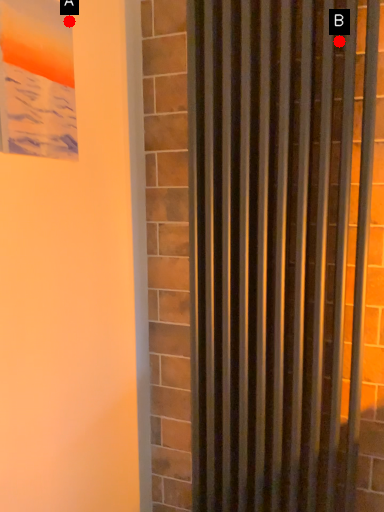
Question: Two points are circled on the image, labeled by A and B beside each circle. Which point appears farthest from the camera in this image?

Choices:
 (A) A is further
 (B) B is further

Answer: (B)